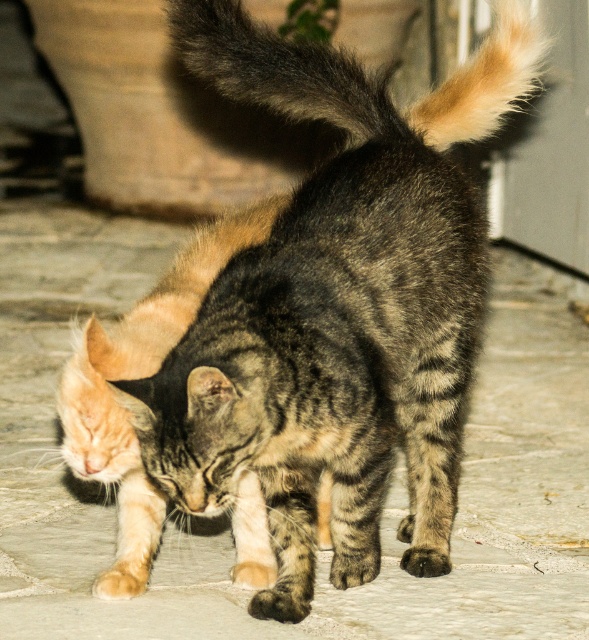
You are a photographer trying to capture a photo of the tabby fur cat at center and the fuzzy fur tail at upper center. Which of the two subjects is positioned higher in the frame?

The fuzzy fur tail at upper center is positioned higher in the frame than the tabby fur cat at center.